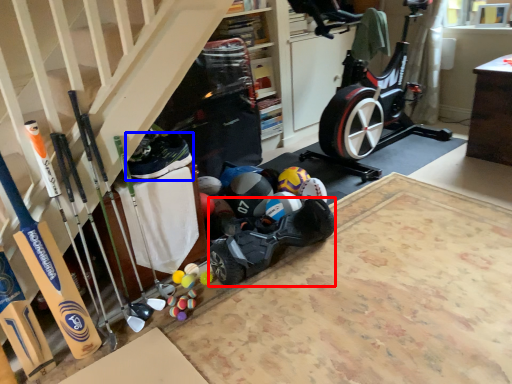
Question: Among these objects, which one is farthest to the camera, car (highlighted by a red box) or shoe (highlighted by a blue box)?

Choices:
 (A) car
 (B) shoe

Answer: (A)